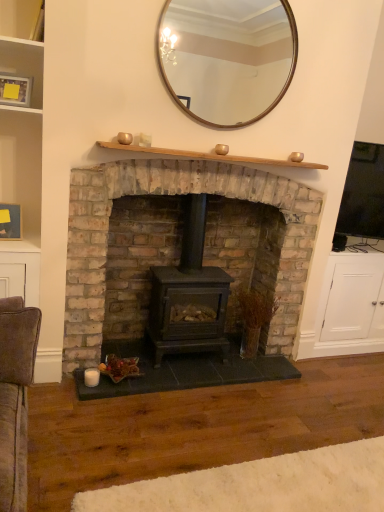
You are a GUI agent. You are given a task and a screenshot of the screen. Output one action in this format:
    pyautogui.click(x=<x>, y=<y>)
    Task: Click on the blank space above wooden shelf at upper center (from a real-world perspective)
    This screenshot has height=512, width=384.
    Given the screenshot: What is the action you would take?
    pyautogui.click(x=216, y=155)